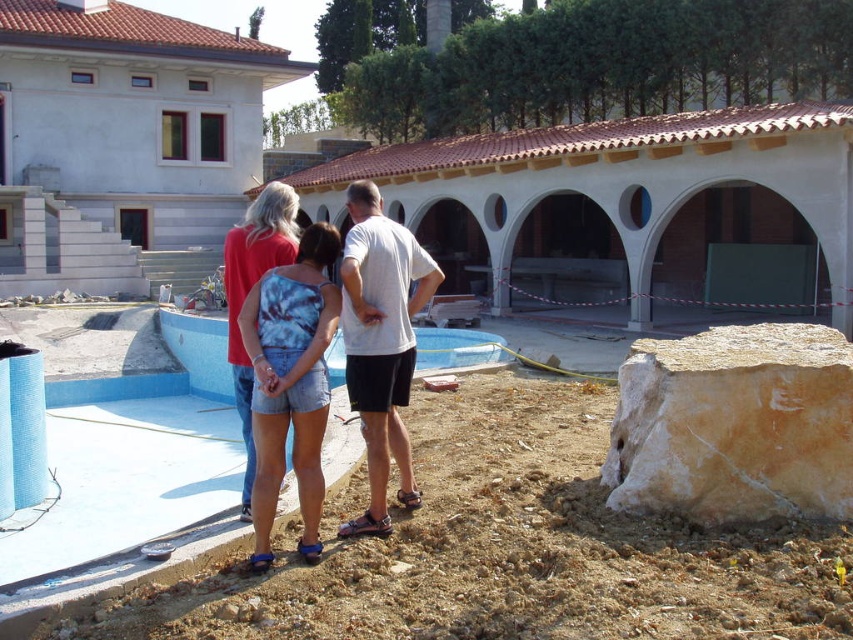
You are a construction worker at the site. You need to place a new tool box at point (248,289). What object will be at that location?

The tie dye fabric tank top at center is located at point (248,289), so placing the tool box there would displace it.